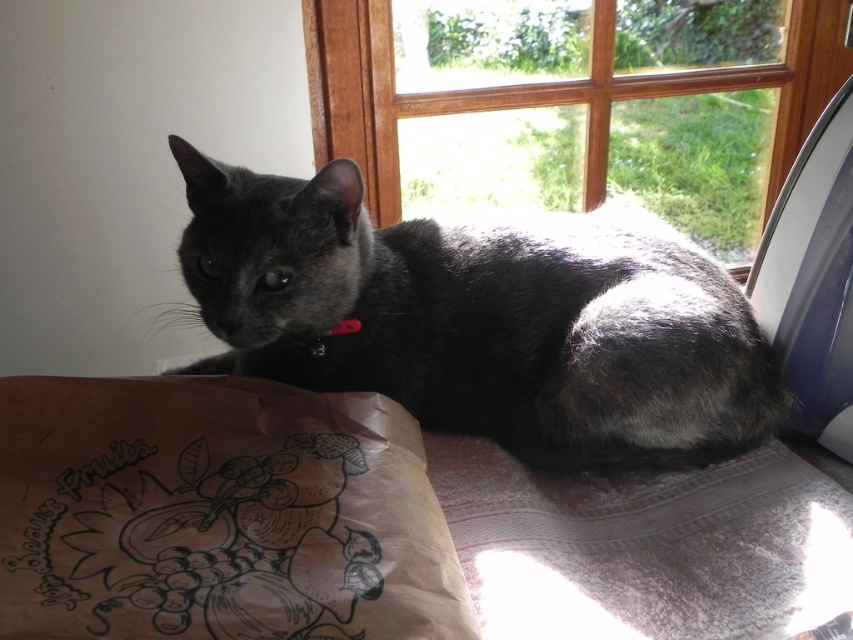
You are a photographer setting up a shoot in the room. You need to position a light source so that it illuminates both the wooden frame at upper center and the black fabric neckband at center without casting harsh shadows. Given their positions, where should you place the light relative to these objects?

The wooden frame at upper center is above the black fabric neckband at center, so placing the light source above both objects would ensure even illumination and minimize harsh shadows.

You are a cat owner who wants to hang a small decorative item on the wooden frame at upper center and the black fabric neckband at center. Which object can accommodate the item better based on their sizes?

The wooden frame at upper center is larger in size than the black fabric neckband at center, so the wooden frame at upper center can accommodate the item better.